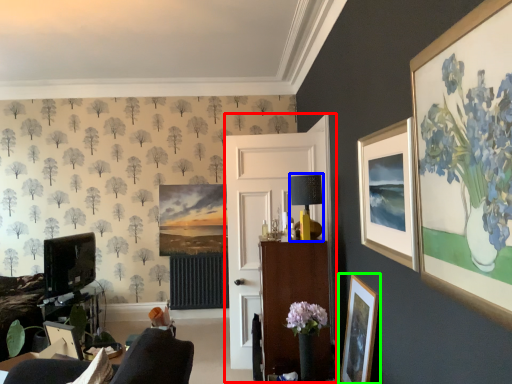
Question: Which is farther away from side (highlighted by a red box)? lamp (highlighted by a blue box) or picture frame (highlighted by a green box)?

Choices:
 (A) lamp
 (B) picture frame

Answer: (B)